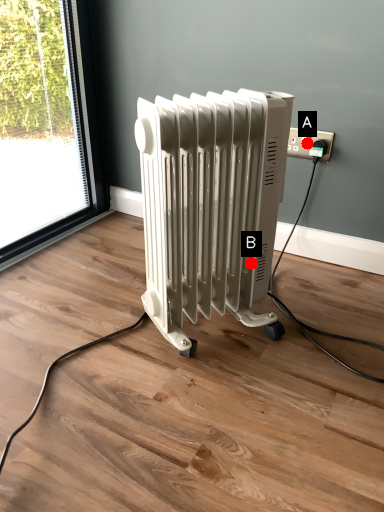
Question: Two points are circled on the image, labeled by A and B beside each circle. Which of the following is the closest to the observer?

Choices:
 (A) A is closer
 (B) B is closer

Answer: (B)